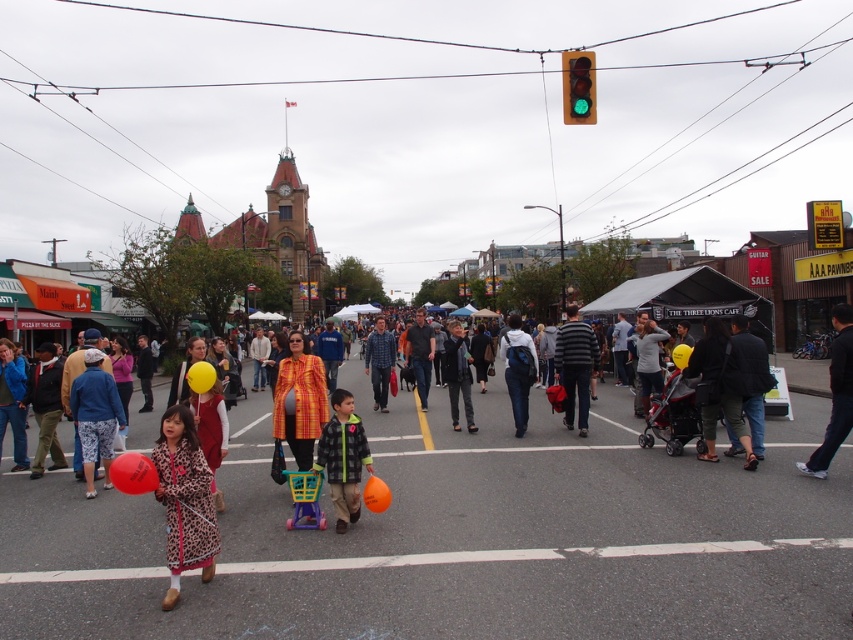
Can you confirm if leopard print coat at lower left is positioned below flannel shirt at center?

Indeed, leopard print coat at lower left is positioned under flannel shirt at center.

Is leopard print coat at lower left further to camera compared to flannel shirt at center?

No.

Does point (207, 573) come in front of point (326, 433)?

Yes, point (207, 573) is closer to viewer.

This screenshot has height=640, width=853. I want to click on leopard print coat at lower left, so click(184, 499).

Can you confirm if striped cotton sweater at center is taller than blue backpack at center?

Indeed, striped cotton sweater at center has a greater height compared to blue backpack at center.

How far apart are striped cotton sweater at center and blue backpack at center?

striped cotton sweater at center is 1.73 meters from blue backpack at center.

Does point (592, 348) come farther from viewer compared to point (514, 374)?

No, (592, 348) is closer to viewer.

Where is `striped cotton sweater at center`? This screenshot has height=640, width=853. striped cotton sweater at center is located at coordinates (575, 365).

Is leopard print dress at center bigger than dark gray jacket at center?

No, leopard print dress at center is not bigger than dark gray jacket at center.

Is point (213, 371) positioned behind point (450, 339)?

That is False.

This screenshot has height=640, width=853. Find the location of `leopard print dress at center`. leopard print dress at center is located at coordinates (207, 412).